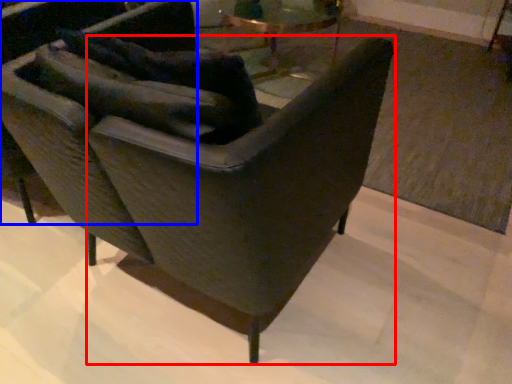
Question: Among these objects, which one is nearest to the camera, rocking chair (highlighted by a red box) or chair (highlighted by a blue box)?

Choices:
 (A) rocking chair
 (B) chair

Answer: (A)